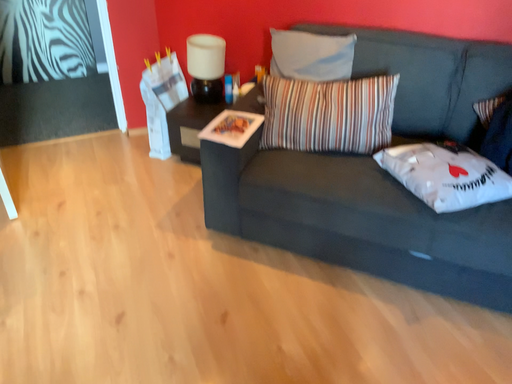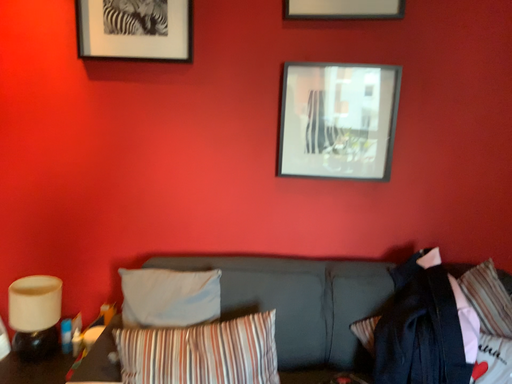
Question: Which way did the camera rotate in the video?

Choices:
 (A) rotated upward
 (B) rotated downward

Answer: (A)